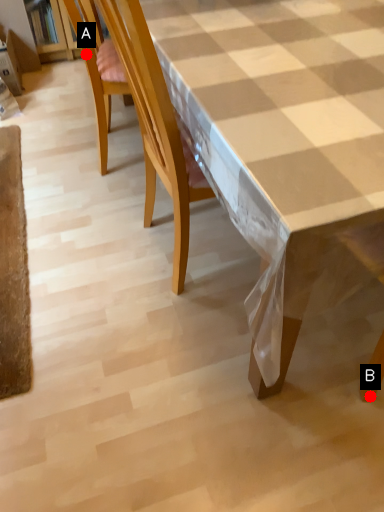
Question: Two points are circled on the image, labeled by A and B beside each circle. Which point is closer to the camera?

Choices:
 (A) A is closer
 (B) B is closer

Answer: (B)